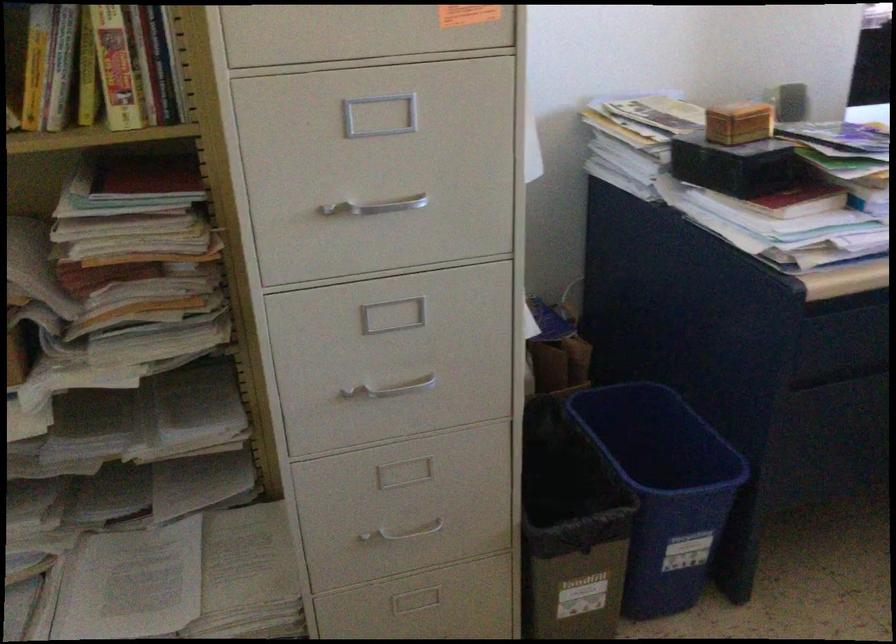
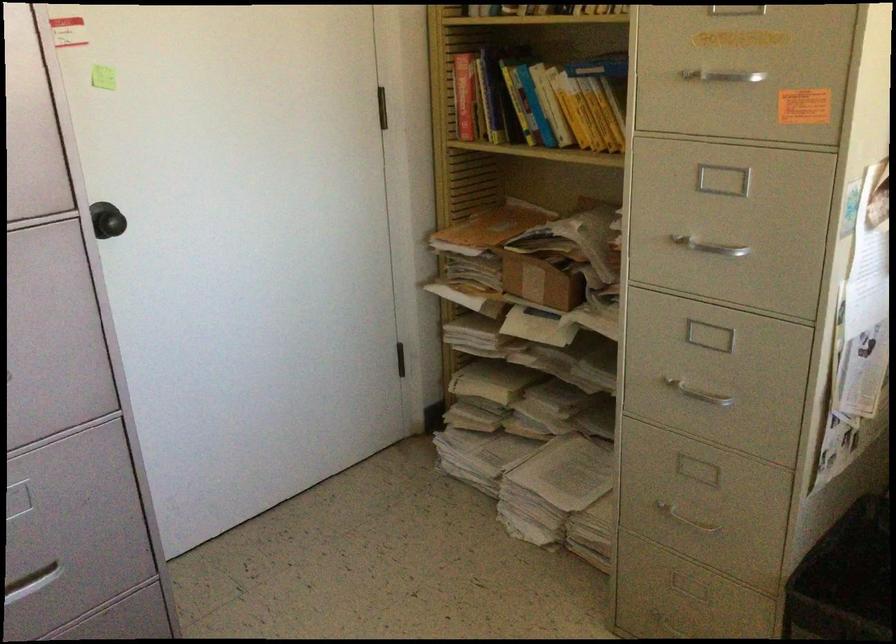
In the second image, find the point that corresponds to (385,205) in the first image.

(710, 248)